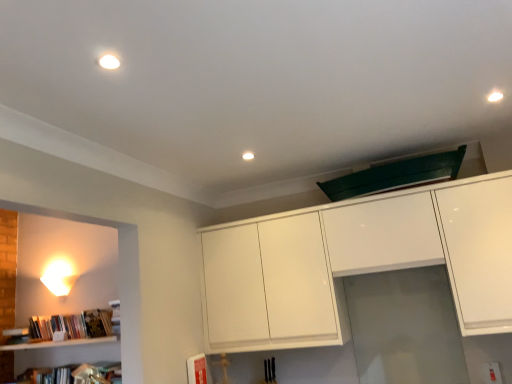
Measure the distance between white glossy wall sconce at left and camera.

A distance of 11.35 feet exists between white glossy wall sconce at left and camera.

What is the approximate width of white glossy wall sconce at left?

It is 6.82 inches.

In order to face transparent glass door at center, should I rotate leftwards or rightwards?

To face it directly, rotate right by 18.864 degrees.

Where is `transparent glass door at center`? This screenshot has width=512, height=384. transparent glass door at center is located at coordinates (405, 327).

I want to click on white glossy cabinet at upper center, so click(x=356, y=262).

From the image's perspective, between white glossy cabinet at upper center and transparent glass door at center, which one is located above?

white glossy cabinet at upper center is shown above in the image.

Considering the sizes of white glossy cabinet at upper center and transparent glass door at center in the image, is white glossy cabinet at upper center taller or shorter than transparent glass door at center?

Considering their sizes, white glossy cabinet at upper center has more height than transparent glass door at center.

Is point (481, 271) closer or farther from the camera than point (406, 348)?

Point (481, 271) is positioned closer to the camera compared to point (406, 348).

Is transparent glass door at center looking in the opposite direction of white glossy cabinet at upper center?

transparent glass door at center is not turned away from white glossy cabinet at upper center.

Does transparent glass door at center have a smaller size compared to white glossy cabinet at upper center?

Yes, transparent glass door at center is smaller than white glossy cabinet at upper center.

Is transparent glass door at center not inside white glossy cabinet at upper center?

transparent glass door at center lies outside white glossy cabinet at upper center's area.

Find the location of a particular element. The height and width of the screenshot is (384, 512). cabinetry above the transparent glass door at center (from a real-world perspective) is located at coordinates (356, 262).

How much distance is there between white glossy wall sconce at left and transparent glass door at center?

white glossy wall sconce at left and transparent glass door at center are 8.23 feet apart from each other.

From the image's perspective, which one is positioned higher, white glossy wall sconce at left or transparent glass door at center?

white glossy wall sconce at left appears higher in the image.

Between point (56, 276) and point (351, 321), which one is positioned behind?

Point (56, 276)

What's the angular difference between white glossy wall sconce at left and transparent glass door at center's facing directions?

The angular difference between white glossy wall sconce at left and transparent glass door at center is 0.861 degrees.

Considering the relative positions of white glossy cabinet at upper center and white glossy wall sconce at left in the image provided, is white glossy cabinet at upper center to the left of white glossy wall sconce at left from the viewer's perspective?

No.

Consider the image. From a real-world perspective, is white glossy cabinet at upper center physically located above or below white glossy wall sconce at left?

white glossy cabinet at upper center is situated lower than white glossy wall sconce at left in the real world.

Is white glossy cabinet at upper center shorter than white glossy wall sconce at left?

In fact, white glossy cabinet at upper center may be taller than white glossy wall sconce at left.

Does white glossy wall sconce at left have a greater height compared to white glossy cabinet at upper center?

No, white glossy wall sconce at left is not taller than white glossy cabinet at upper center.

Considering the relative sizes of white glossy wall sconce at left and white glossy cabinet at upper center in the image provided, is white glossy wall sconce at left smaller than white glossy cabinet at upper center?

Yes, white glossy wall sconce at left is smaller than white glossy cabinet at upper center.

Looking at this image, can you confirm if white glossy wall sconce at left is wider than white glossy cabinet at upper center?

No, white glossy wall sconce at left is not wider than white glossy cabinet at upper center.

Is white glossy wall sconce at left at the right side of white glossy cabinet at upper center?

No, white glossy wall sconce at left is not to the right of white glossy cabinet at upper center.

Can you confirm if transparent glass door at center is taller than white glossy wall sconce at left?

Indeed, transparent glass door at center has a greater height compared to white glossy wall sconce at left.

Is point (352, 324) positioned before point (58, 287)?

Yes, point (352, 324) is in front of point (58, 287).

Which is in front, transparent glass door at center or white glossy wall sconce at left?

transparent glass door at center is closer to the camera.

Find the location of a particular element. This screenshot has width=512, height=384. cabinetry above the transparent glass door at center (from the image's perspective) is located at coordinates (356, 262).

You are a GUI agent. You are given a task and a screenshot of the screen. Output one action in this format:
    pyautogui.click(x=<x>, y=<y>)
    Task: Click on the cabinetry above the transparent glass door at center (from a real-world perspective)
    This screenshot has height=384, width=512.
    Given the screenshot: What is the action you would take?
    pyautogui.click(x=356, y=262)

Considering their positions, is white glossy wall sconce at left positioned further to transparent glass door at center than white glossy cabinet at upper center?

white glossy wall sconce at left is positioned further to the anchor transparent glass door at center.

Considering their positions, is transparent glass door at center positioned closer to white glossy cabinet at upper center than white glossy wall sconce at left?

The object closer to white glossy cabinet at upper center is transparent glass door at center.

Estimate the real-world distances between objects in this image. Which object is further from transparent glass door at center, white glossy cabinet at upper center or white glossy wall sconce at left?

white glossy wall sconce at left lies further to transparent glass door at center than the other object.

Looking at the image, which one is located closer to white glossy wall sconce at left, white glossy cabinet at upper center or transparent glass door at center?

The object closer to white glossy wall sconce at left is white glossy cabinet at upper center.

Considering their positions, is transparent glass door at center positioned further to white glossy wall sconce at left than white glossy cabinet at upper center?

Based on the image, transparent glass door at center appears to be further to white glossy wall sconce at left.

Estimate the real-world distances between objects in this image. Which object is closer to white glossy cabinet at upper center, white glossy wall sconce at left or transparent glass door at center?

The object closer to white glossy cabinet at upper center is transparent glass door at center.

This screenshot has height=384, width=512. Find the location of `cabinetry situated between white glossy wall sconce at left and transparent glass door at center from left to right`. cabinetry situated between white glossy wall sconce at left and transparent glass door at center from left to right is located at coordinates (356, 262).